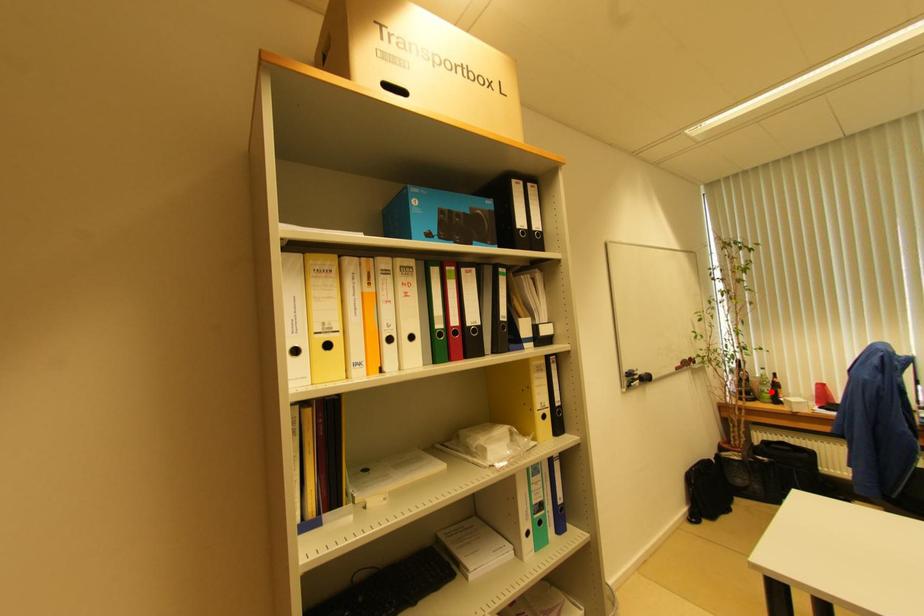
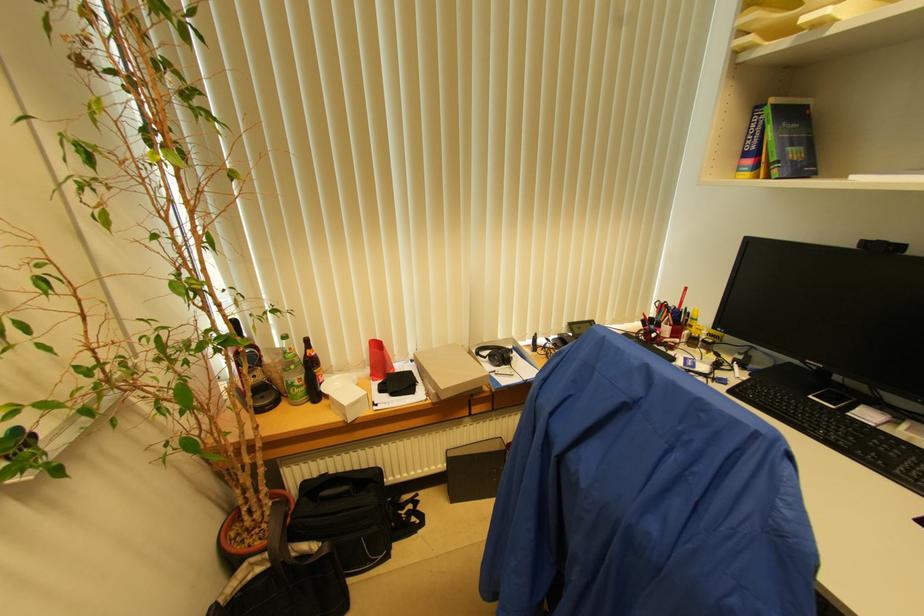
Question: I am providing you with two images of the same scene from different viewpoints. A red point is marked on the first image. Can you still see the location of the red point in image 2?

Choices:
 (A) Yes
 (B) No

Answer: (A)